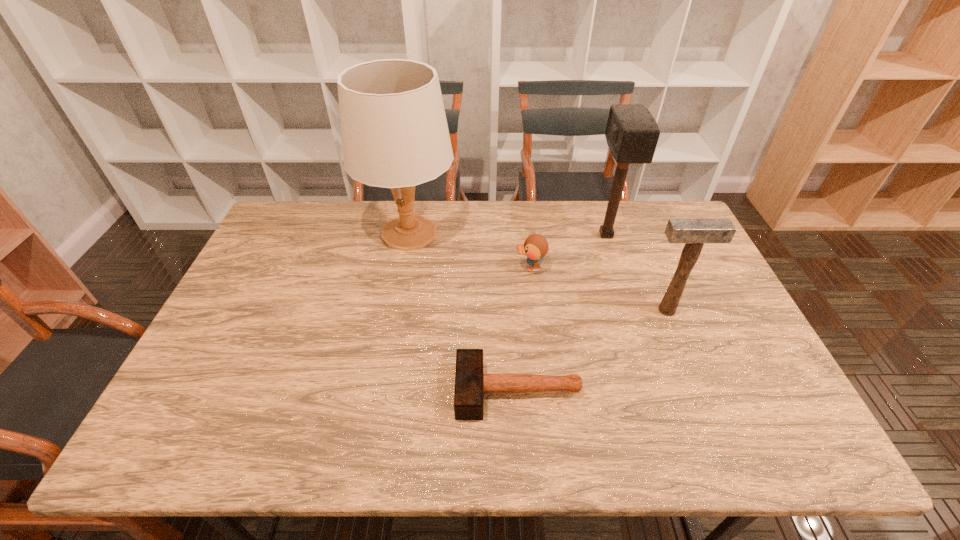
Where is `vacant space positioned on the left of the tallest mallet`? The image size is (960, 540). vacant space positioned on the left of the tallest mallet is located at coordinates click(558, 235).

I want to click on free space located 0.130m on the left of the second farthest mallet, so click(x=594, y=310).

Locate an element on the screen. The image size is (960, 540). free space located on the front-facing side of the duck is located at coordinates (489, 268).

Where is `free region located 0.360m on the front-facing side of the duck`? free region located 0.360m on the front-facing side of the duck is located at coordinates (398, 268).

Find the location of a particular element. Image resolution: width=960 pixels, height=540 pixels. free spot located on the front-facing side of the duck is located at coordinates (476, 268).

The width and height of the screenshot is (960, 540). In order to click on free point located on the hammer head face of the nearest object in this screenshot , I will do `click(314, 391)`.

Identify the location of free space located on the hammer head face of the nearest object. (348, 391).

Find the location of a particular element. The height and width of the screenshot is (540, 960). vacant space situated on the hammer head face of the nearest object is located at coordinates (381, 391).

Where is `table lamp that is at the far edge`? table lamp that is at the far edge is located at coordinates (394, 131).

At what (x,y) coordinates should I click in order to perform the action: click on mallet present at the far edge. Please return your answer as a coordinate pair (x, y). The height and width of the screenshot is (540, 960). Looking at the image, I should click on (632, 133).